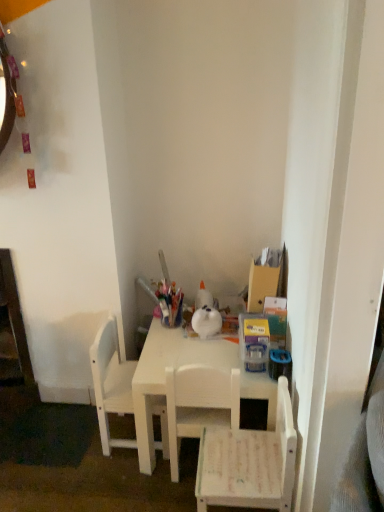
Find the location of `blank space above white matte table at center (from a real-world perspective)`. blank space above white matte table at center (from a real-world perspective) is located at coordinates (191, 345).